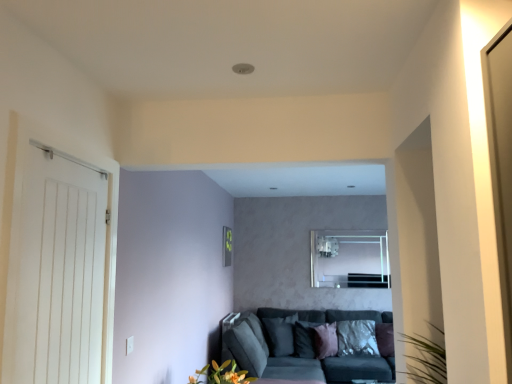
Describe the element at coordinates (60, 269) in the screenshot. I see `white wooden door at left` at that location.

This screenshot has width=512, height=384. I want to click on clear glass mirror at upper center, so click(x=350, y=259).

What are the coordinates of `matte orange flowers at lower center` in the screenshot? It's located at (221, 374).

This screenshot has height=384, width=512. Identify the location of purple velvet pillow at lower right, marked as the first pillow in a right-to-left arrangement. (385, 339).

Which point is more forward, (x=278, y=338) or (x=319, y=333)?

The point (x=319, y=333) is in front.

Which is in front, silky purple pillow at center, arranged as the second pillow when viewed from the left, or pink velvet pillow at center, arranged as the fourth pillow when viewed from the left?

pink velvet pillow at center, arranged as the fourth pillow when viewed from the left, is in front.

Does silky purple pillow at center, the 5th pillow when ordered from right to left, have a lesser height compared to pink velvet pillow at center, arranged as the fourth pillow when viewed from the left?

Incorrect, the height of silky purple pillow at center, the 5th pillow when ordered from right to left, does not fall short of that of pink velvet pillow at center, arranged as the fourth pillow when viewed from the left.

Between point (300, 347) and point (47, 379), which one is positioned in front?

The point (47, 379) is in front.

In the scene shown: From a real-world perspective, who is located lower, silky purple pillow at center, arranged as the third pillow when viewed from the left, or white wooden door at left?

silky purple pillow at center, arranged as the third pillow when viewed from the left, is physically lower.

Who is shorter, silky purple pillow at center, arranged as the third pillow when viewed from the left, or white wooden door at left?

silky purple pillow at center, arranged as the third pillow when viewed from the left, is shorter.

From the picture: From the image's perspective, which object appears higher, silky purple pillow at center, arranged as the third pillow when viewed from the left, or white wooden door at left?

white wooden door at left is shown above in the image.

Is silky purple pillow at center, the 5th pillow when ordered from right to left, to the left of velvet dark grey couch at lower center from the viewer's perspective?

Correct, you'll find silky purple pillow at center, the 5th pillow when ordered from right to left, to the left of velvet dark grey couch at lower center.

Which object is wider, silky purple pillow at center, the 5th pillow when ordered from right to left, or velvet dark grey couch at lower center?

velvet dark grey couch at lower center.

This screenshot has width=512, height=384. I want to click on pillow that is the 6th object above the velvet dark grey couch at lower center (from a real-world perspective), so tap(280, 335).

From the picture: From a real-world perspective, is silky purple pillow at center, arranged as the second pillow when viewed from the left, on top of velvet dark grey couch at lower center?

Yes, from a real-world perspective, silky purple pillow at center, arranged as the second pillow when viewed from the left, is over velvet dark grey couch at lower center

Does pink velvet pillow at center, arranged as the fourth pillow when viewed from the left, have a larger size compared to velvet purple pillow at center, which is the 2th pillow from right to left?

No.

Considering the sizes of objects pink velvet pillow at center, arranged as the fourth pillow when viewed from the left, and velvet purple pillow at center, which is the 2th pillow from right to left, in the image provided, who is wider, pink velvet pillow at center, arranged as the fourth pillow when viewed from the left, or velvet purple pillow at center, which is the 2th pillow from right to left,?

velvet purple pillow at center, which is the 2th pillow from right to left.

Is pink velvet pillow at center, arranged as the fourth pillow when viewed from the left, at the right side of velvet purple pillow at center, which is the 2th pillow from right to left?

No.

How different are the orientations of pink velvet pillow at center, arranged as the fourth pillow when viewed from the left, and velvet purple pillow at center, the 5th pillow positioned from the left, in degrees?

45.3 degrees.

Are pink velvet pillow at center, placed as the 3th pillow when sorted from right to left, and velvet dark grey couch at lower center located far from each other?

No, pink velvet pillow at center, placed as the 3th pillow when sorted from right to left, is in close proximity to velvet dark grey couch at lower center.

The image size is (512, 384). What are the coordinates of `the 1st pillow to the right of the velvet dark grey couch at lower center, starting your count from the anchor` in the screenshot? It's located at (325, 340).

Is pink velvet pillow at center, placed as the 3th pillow when sorted from right to left, looking in the opposite direction of velvet dark grey couch at lower center?

Yes, pink velvet pillow at center, placed as the 3th pillow when sorted from right to left, is positioned with its back facing velvet dark grey couch at lower center.

Based on the photo, what's the angular difference between pink velvet pillow at center, arranged as the fourth pillow when viewed from the left, and velvet dark grey couch at lower center's facing directions?

pink velvet pillow at center, arranged as the fourth pillow when viewed from the left, and velvet dark grey couch at lower center are facing 46.2 degrees away from each other.

Is white wooden door at left to the left or to the right of matte orange flowers at lower center in the image?

In the image, white wooden door at left appears on the left side of matte orange flowers at lower center.

From a real-world perspective, who is located lower, white wooden door at left or matte orange flowers at lower center?

In real-world perspective, matte orange flowers at lower center is lower.

Are white wooden door at left and matte orange flowers at lower center beside each other?

There is a gap between white wooden door at left and matte orange flowers at lower center.

Is white wooden door at left further to camera compared to matte orange flowers at lower center?

That is False.

Find the location of a particular element. Image resolution: width=512 pixels, height=384 pixels. the 5th pillow below when counting from the clear glass mirror at upper center (from the image's perspective) is located at coordinates (357, 338).

Is clear glass mirror at upper center facing away from velvet purple pillow at center, the 5th pillow positioned from the left?

That's not correct — clear glass mirror at upper center is not looking away from velvet purple pillow at center, the 5th pillow positioned from the left.

Between clear glass mirror at upper center and velvet purple pillow at center, the 5th pillow positioned from the left, which one appears on the left side from the viewer's perspective?

clear glass mirror at upper center is more to the left.

From the image's perspective, would you say clear glass mirror at upper center is positioned over velvet purple pillow at center, which is the 2th pillow from right to left?

Yes, from the image's perspective, clear glass mirror at upper center is over velvet purple pillow at center, which is the 2th pillow from right to left.

Where is `pillow that is the 3rd one when counting upward from the pink velvet pillow at center, arranged as the fourth pillow when viewed from the left (from the image's perspective)`? pillow that is the 3rd one when counting upward from the pink velvet pillow at center, arranged as the fourth pillow when viewed from the left (from the image's perspective) is located at coordinates (280, 335).

Identify the location of the 4th pillow below when counting from the white wooden door at left (from the image's perspective). (305, 339).

Consider the image. From the image, which object appears to be nearer to purple velvet pillow at lower right, marked as the first pillow in a right-to-left arrangement, velvet purple pillow at center, the 5th pillow positioned from the left, or silky purple pillow at lower center, the first pillow from the left?

velvet purple pillow at center, the 5th pillow positioned from the left, lies closer to purple velvet pillow at lower right, marked as the first pillow in a right-to-left arrangement, than the other object.

Estimate the real-world distances between objects in this image. Which object is closer to silky purple pillow at center, acting as the fourth pillow starting from the right, clear glass mirror at upper center or pink velvet pillow at center, arranged as the fourth pillow when viewed from the left?

Based on the image, pink velvet pillow at center, arranged as the fourth pillow when viewed from the left, appears to be nearer to silky purple pillow at center, acting as the fourth pillow starting from the right.

Based on their spatial positions, is silky purple pillow at center, arranged as the second pillow when viewed from the left, or pink velvet pillow at center, placed as the 3th pillow when sorted from right to left, further from silky purple pillow at lower center, the first pillow from the left?

The object further to silky purple pillow at lower center, the first pillow from the left, is pink velvet pillow at center, placed as the 3th pillow when sorted from right to left.

Which object lies nearer to the anchor point velvet dark grey couch at lower center, purple velvet pillow at lower right, positioned as the 6th pillow in left-to-right order, or silky purple pillow at lower center, the first pillow from the left?

The object closer to velvet dark grey couch at lower center is silky purple pillow at lower center, the first pillow from the left.

Looking at this image, looking at the image, which one is located further to silky purple pillow at center, the 5th pillow when ordered from right to left, white wooden door at left or clear glass mirror at upper center?

white wooden door at left lies further to silky purple pillow at center, the 5th pillow when ordered from right to left, than the other object.

Considering their positions, is silky purple pillow at lower center, the first pillow from the left, positioned further to silky purple pillow at center, arranged as the second pillow when viewed from the left, than velvet dark grey couch at lower center?

Among the two, silky purple pillow at lower center, the first pillow from the left, is located further to silky purple pillow at center, arranged as the second pillow when viewed from the left.

Estimate the real-world distances between objects in this image. Which object is further from silky purple pillow at center, arranged as the third pillow when viewed from the left, pink velvet pillow at center, arranged as the fourth pillow when viewed from the left, or velvet purple pillow at center, which is the 2th pillow from right to left?

Based on the image, velvet purple pillow at center, which is the 2th pillow from right to left, appears to be further to silky purple pillow at center, arranged as the third pillow when viewed from the left.

Based on their spatial positions, is silky purple pillow at center, arranged as the second pillow when viewed from the left, or velvet dark grey couch at lower center closer to clear glass mirror at upper center?

Among the two, velvet dark grey couch at lower center is located nearer to clear glass mirror at upper center.

This screenshot has height=384, width=512. Find the location of `studio couch between matte orange flowers at lower center and velvet purple pillow at center, the 5th pillow positioned from the left, from front to back`. studio couch between matte orange flowers at lower center and velvet purple pillow at center, the 5th pillow positioned from the left, from front to back is located at coordinates (300, 347).

I want to click on studio couch located between white wooden door at left and purple velvet pillow at lower right, positioned as the 6th pillow in left-to-right order, in the depth direction, so click(x=300, y=347).

Locate an element on the screen. The width and height of the screenshot is (512, 384). floral arrangement between white wooden door at left and velvet purple pillow at center, the 5th pillow positioned from the left, along the z-axis is located at coordinates (221, 374).

Find the location of a particular element. studio couch positioned between white wooden door at left and pink velvet pillow at center, placed as the 3th pillow when sorted from right to left, from near to far is located at coordinates (300, 347).